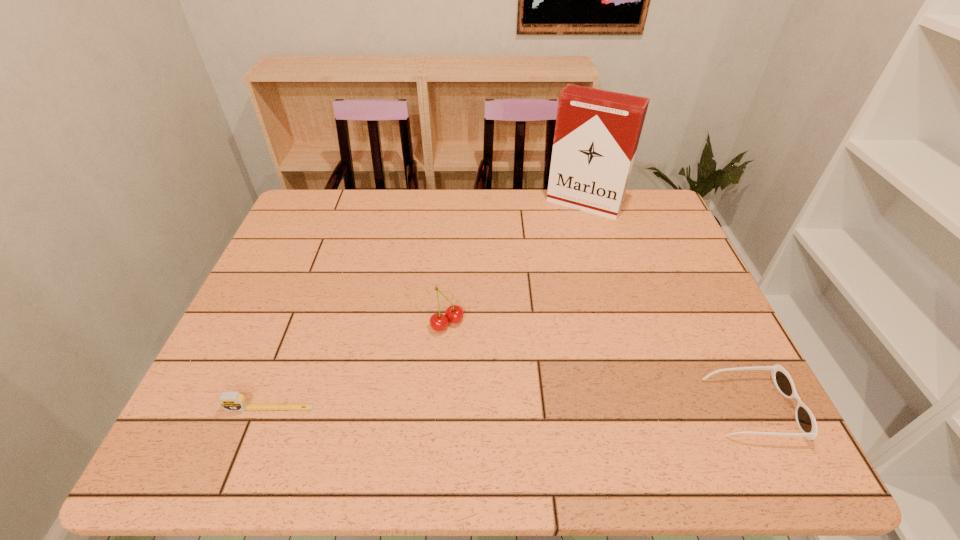
Image resolution: width=960 pixels, height=540 pixels. I want to click on vacant area in the image that satisfies the following two spatial constraints: 1. on the front side of the cherry; 2. with the lenses of the rightmost object facing outward, so click(x=442, y=408).

Identify the location of vacant space that satisfies the following two spatial constraints: 1. on the front side of the third nearest object; 2. with the lenses of the rightmost object facing outward. (442, 408).